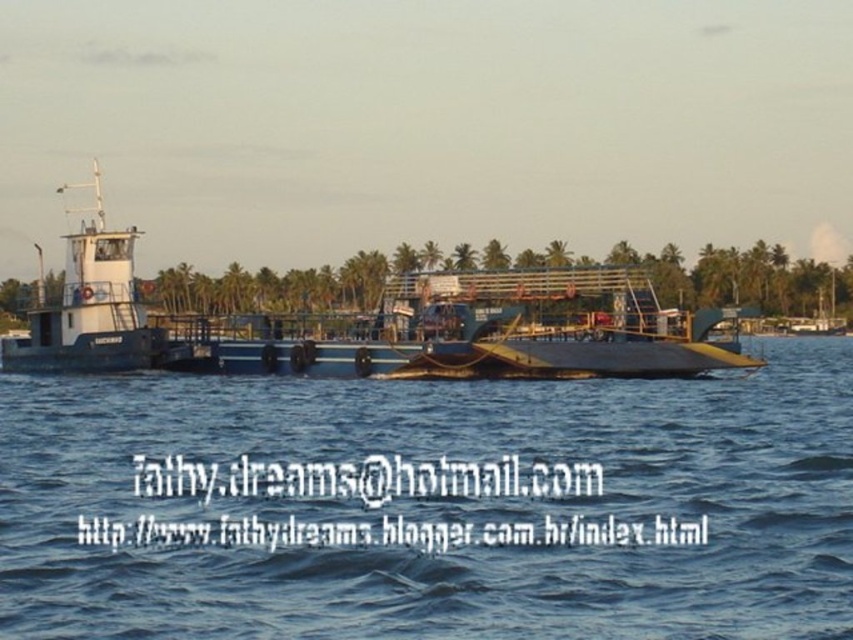
Question: Is blue water at center positioned in front of blue matte ferryboat at center?

Choices:
 (A) no
 (B) yes

Answer: (B)

Question: Which of the following is the farthest from the observer?

Choices:
 (A) blue matte ferryboat at center
 (B) blue water at center

Answer: (A)

Question: Can you confirm if blue water at center is wider than blue matte ferryboat at center?

Choices:
 (A) no
 (B) yes

Answer: (A)

Question: Is blue water at center wider than blue matte ferryboat at center?

Choices:
 (A) no
 (B) yes

Answer: (A)

Question: Which point appears farthest from the camera in this image?

Choices:
 (A) (402, 444)
 (B) (38, 307)

Answer: (B)